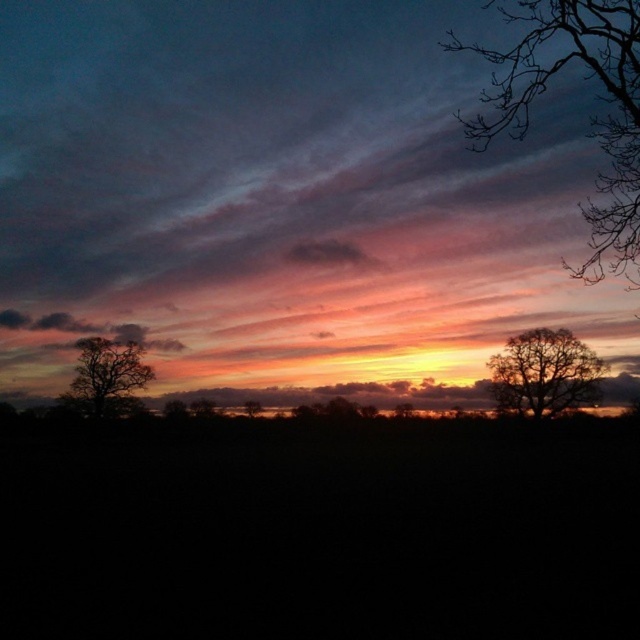
Is silhouette tree at left further to camera compared to silhouette tree at center?

No, silhouette tree at left is closer to the viewer.

In the scene shown: Between silhouette tree at left and silhouette tree at center, which one appears on the left side from the viewer's perspective?

silhouette tree at left

Is point (131, 369) positioned before point (248, 404)?

Yes, point (131, 369) is closer to viewer.

Image resolution: width=640 pixels, height=640 pixels. What are the coordinates of `silhouette tree at left` in the screenshot? It's located at (106, 378).

Who is positioned more to the left, matte pink cloud at center or silhouette tree at left?

silhouette tree at left

Who is taller, matte pink cloud at center or silhouette tree at left?

With more height is matte pink cloud at center.

Which is in front, point (392, 346) or point (125, 355)?

Point (125, 355) is in front.

What are the coordinates of `matte pink cloud at center` in the screenshot? It's located at (291, 193).

Describe the element at coordinates (592, 118) in the screenshot. I see `bare branches at upper right` at that location.

Image resolution: width=640 pixels, height=640 pixels. In order to click on bare branches at upper right in this screenshot , I will do `click(592, 118)`.

You are a GUI agent. You are given a task and a screenshot of the screen. Output one action in this format:
    pyautogui.click(x=<x>, y=<y>)
    Task: Click on the bare branches at upper right
    
    Given the screenshot: What is the action you would take?
    pyautogui.click(x=592, y=118)